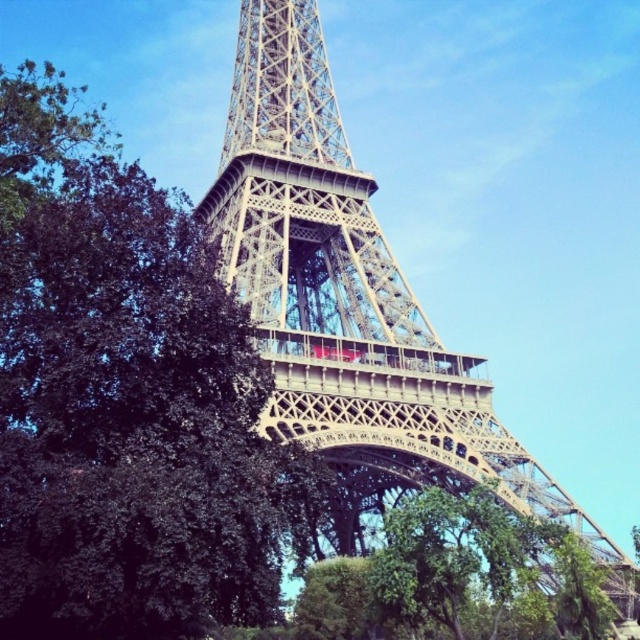
You are standing at the base of the Eiffel Tower and want to take a photo of the metallic structure at center. If your camera can focus on objects up to 150 feet away, will you need to move closer to capture a clear image?

The metallic structure at center is 164.22 feet away from the camera, which is beyond the camera focus range of 150 feet. To capture a clear image, you need to move closer to reduce the distance between you and the metallic structure at center.